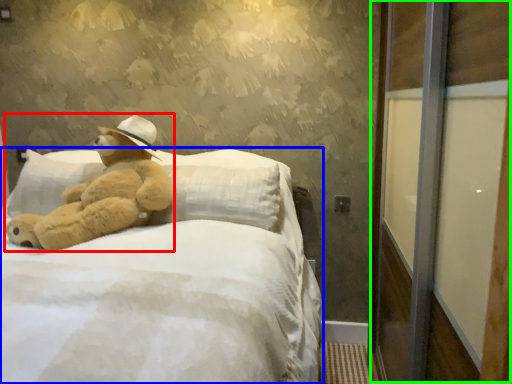
Question: Which object is positioned farthest from teddy bear (highlighted by a red box)? Select from bed (highlighted by a blue box) and screen door (highlighted by a green box).

Choices:
 (A) bed
 (B) screen door

Answer: (B)